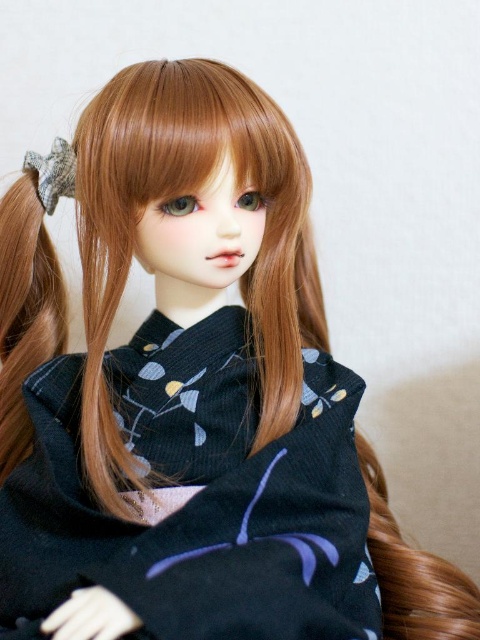
Question: Does dark blue corduroy robe at center come behind plaid fabric scarf at upper left?

Choices:
 (A) yes
 (B) no

Answer: (B)

Question: Which of the following is the closest to the observer?

Choices:
 (A) (36, 348)
 (B) (384, 570)
 (C) (289, 620)
 (D) (61, 195)

Answer: (C)

Question: Among these objects, which one is farthest from the camera?

Choices:
 (A) brown silky hair at lower right
 (B) light brown silky hair at left
 (C) dark blue corduroy robe at center

Answer: (B)

Question: Can you confirm if light brown silky hair at left is positioned to the right of brown silky hair at lower right?

Choices:
 (A) yes
 (B) no

Answer: (B)

Question: Which of these objects is positioned closest to the brown silky hair at lower right?

Choices:
 (A) plaid fabric scarf at upper left
 (B) dark blue corduroy robe at center

Answer: (B)

Question: Is dark blue corduroy robe at center smaller than brown silky hair at lower right?

Choices:
 (A) yes
 (B) no

Answer: (B)